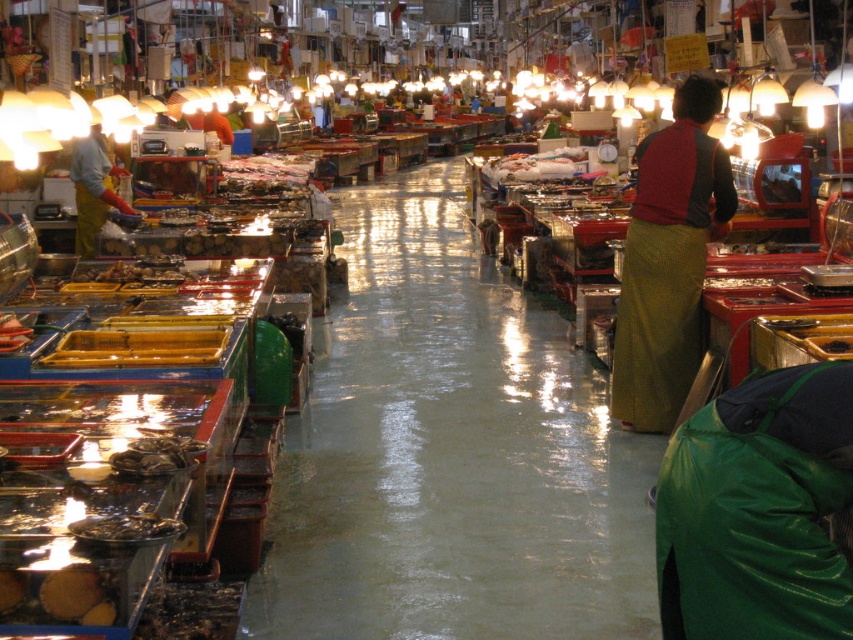
You are a customer at the market and want to place the smooth brown bread at lower left on top of the green woven skirt at right. Will the bread fit on the skirt without overhanging?

The green woven skirt at right is wider than the smooth brown bread at lower left, so the bread will fit on the skirt without overhanging.